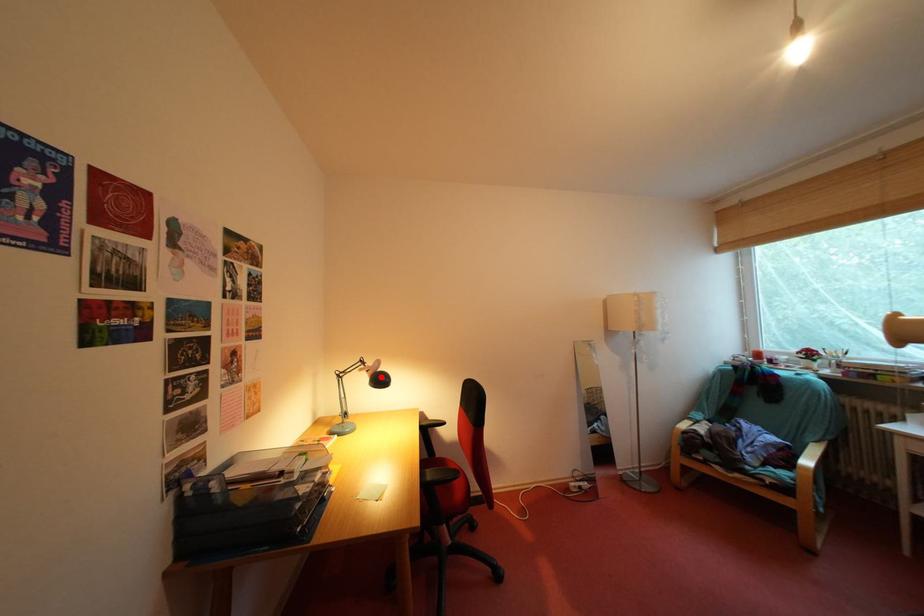
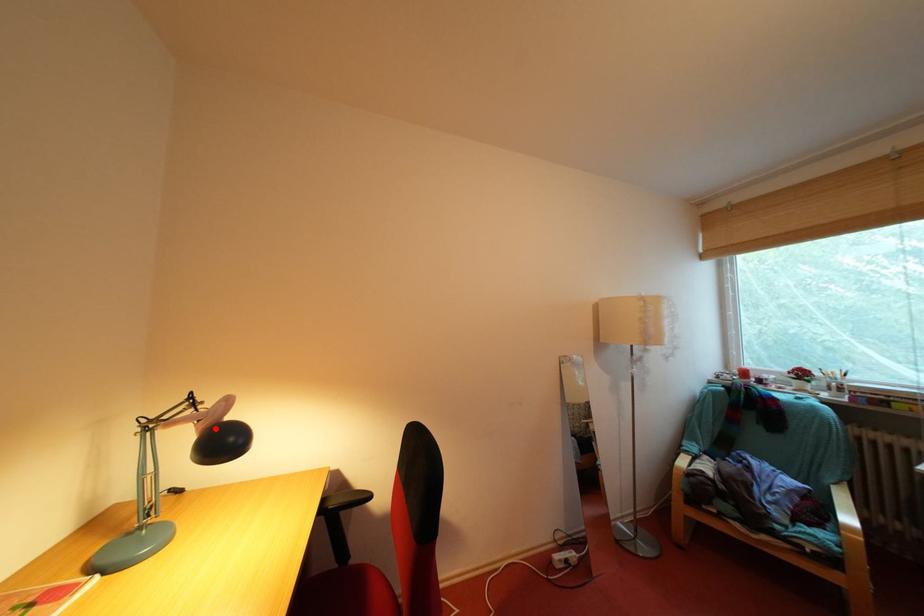
I am providing you with two images of the same scene from different viewpoints. A red point is marked on the first image and another point is marked on the second image. Is the red point in image1 aligned with the point shown in image2?

Yes